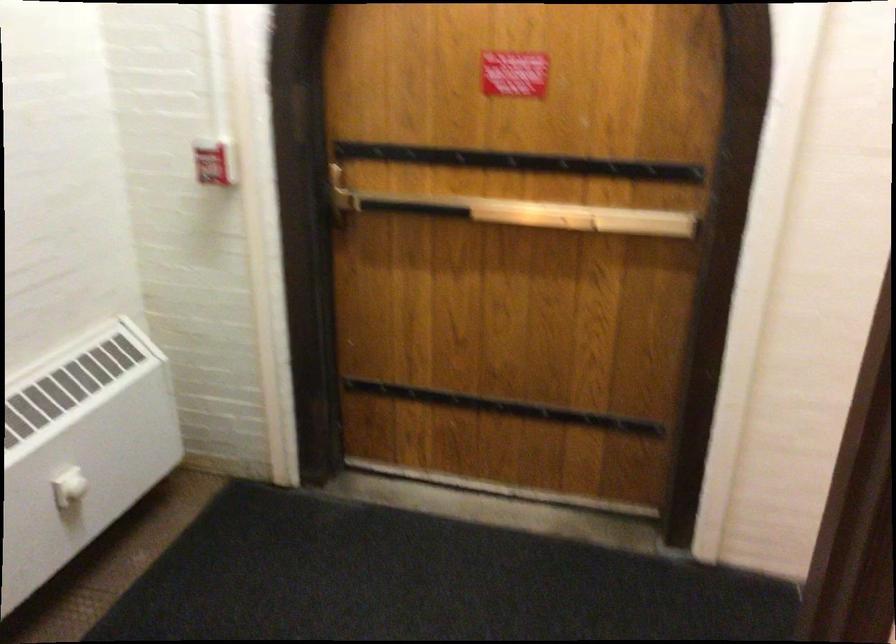
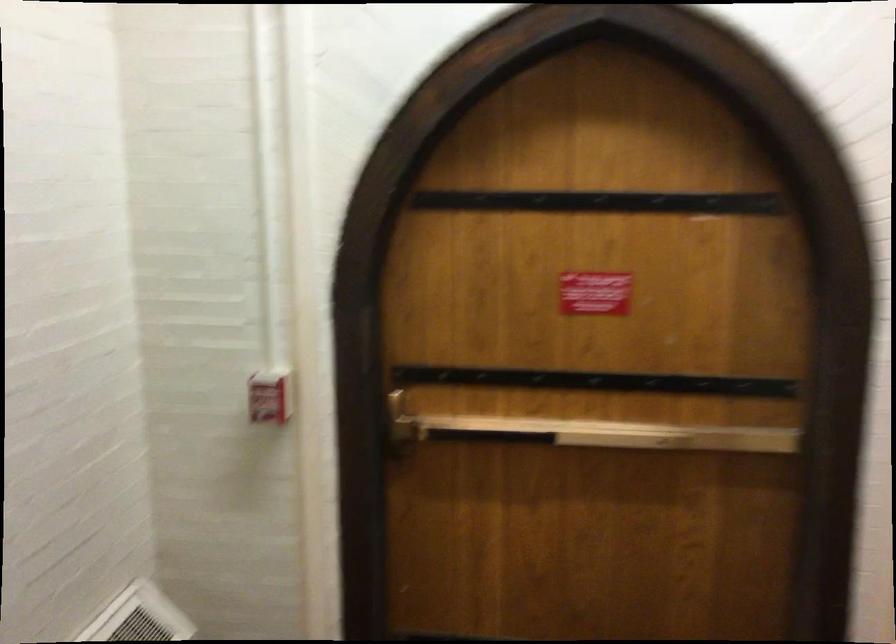
Question: The first image is from the beginning of the video and the second image is from the end. How did the camera likely rotate when shooting the video?

Choices:
 (A) Left
 (B) Right
 (C) Up
 (D) Down

Answer: (C)